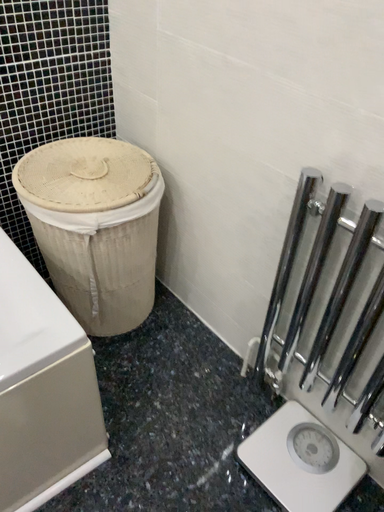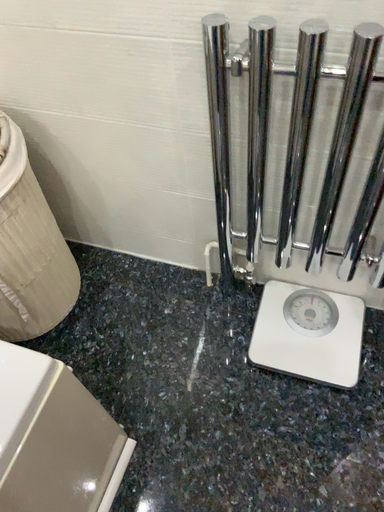
Question: Which way did the camera rotate in the video?

Choices:
 (A) rotated left
 (B) rotated right

Answer: (B)